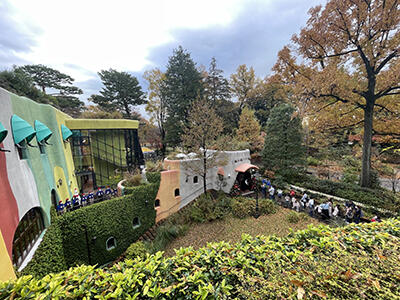
The image size is (400, 300). I want to click on windows, so click(175, 191), click(157, 200), click(137, 220), click(112, 242), click(28, 231), click(194, 178).